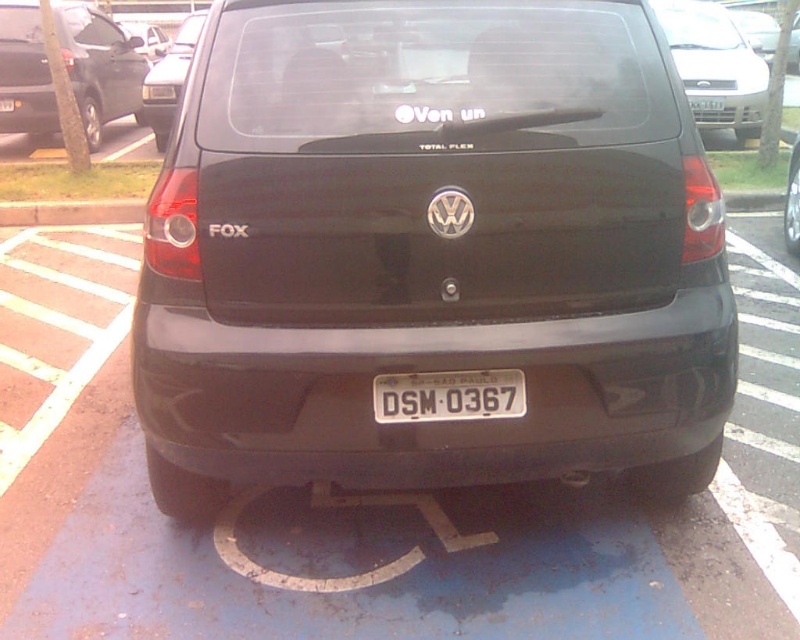
Between matte black car at center and matte black car at upper left, which one is positioned higher?

matte black car at upper left

Between matte black car at center and matte black car at upper left, which one appears on the left side from the viewer's perspective?

matte black car at upper left

Is point (284, 234) more distant than point (180, 51)?

No.

This screenshot has height=640, width=800. What are the coordinates of `matte black car at center` in the screenshot? It's located at (432, 250).

Between matte black suv at upper left and silver metallic sedan at upper right, which one is positioned lower?

matte black suv at upper left

Is point (62, 28) positioned in front of point (694, 1)?

Yes, point (62, 28) is in front of point (694, 1).

At what (x,y) coordinates should I click in order to perform the action: click on matte black suv at upper left. Please return your answer as a coordinate pair (x, y). Image resolution: width=800 pixels, height=640 pixels. Looking at the image, I should click on (100, 67).

At what (x,y) coordinates should I click in order to perform the action: click on matte black suv at upper left. Please return your answer as a coordinate pair (x, y). This screenshot has width=800, height=640. Looking at the image, I should click on (100, 67).

Is matte black suv at upper left positioned behind smooth concrete curb at lower left?

Yes.

Does matte black suv at upper left have a lesser width compared to smooth concrete curb at lower left?

Yes.

Identify the location of matte black suv at upper left. (100, 67).